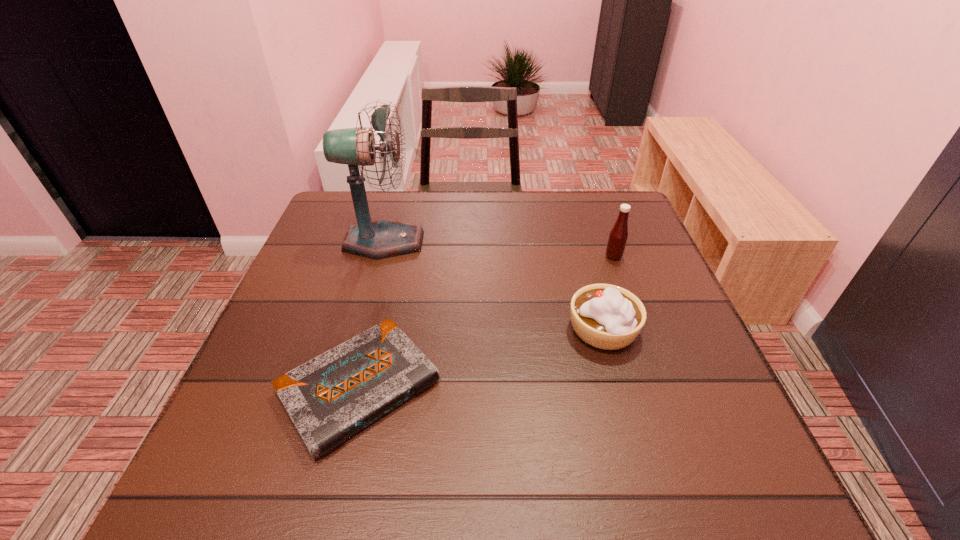
The width and height of the screenshot is (960, 540). Identify the location of blank space at the far left corner. (334, 211).

You are a GUI agent. You are given a task and a screenshot of the screen. Output one action in this format:
    pyautogui.click(x=<x>, y=<y>)
    Task: Click on the free space at the near left corner
    
    Given the screenshot: What is the action you would take?
    pyautogui.click(x=254, y=454)

In the image, there is a desktop. At what (x,y) coordinates should I click in order to perform the action: click on free space at the far right corner. Please return your answer as a coordinate pair (x, y). The height and width of the screenshot is (540, 960). Looking at the image, I should click on (602, 204).

Image resolution: width=960 pixels, height=540 pixels. What are the coordinates of `vacant space at the near right corner of the desktop` in the screenshot? It's located at (664, 455).

At what (x,y) coordinates should I click in order to perform the action: click on empty location between the shortest object and the whipped cream. Please return your answer as a coordinate pair (x, y). Image resolution: width=960 pixels, height=540 pixels. Looking at the image, I should click on (481, 358).

Identify the location of vacant space in between the shortest object and the third tallest object. (481, 358).

Where is `vacant point located between the shortest object and the whipped cream`? vacant point located between the shortest object and the whipped cream is located at coordinates tap(481, 358).

Where is `free space between the tallest object and the second tallest object`? Image resolution: width=960 pixels, height=540 pixels. free space between the tallest object and the second tallest object is located at coordinates (498, 249).

The image size is (960, 540). Find the location of `unoccupied position between the fan and the notebook`. unoccupied position between the fan and the notebook is located at coordinates (372, 314).

This screenshot has height=540, width=960. In order to click on vacant area that lies between the Tabasco sauce and the fan in this screenshot , I will do `click(498, 249)`.